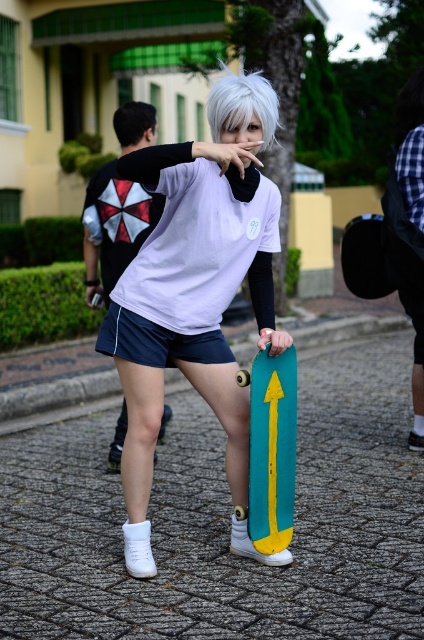
You are trying to determine if the teal matte skateboard at center can fit into a storage compartment that is the same size as the matte white shorts at center. Based on their sizes, will the skateboard fit?

The teal matte skateboard at center occupies less space than the matte white shorts at center, so it will fit into the storage compartment.

You are a photographer planning to capture a closeup shot of the cobblestone pavement at center and the white matte wig at center. Which object should you focus on first if you want to ensure both are in focus without adjusting the camera settings?

The cobblestone pavement at center occupies less space than the white matte wig at center, so you should focus on the white matte wig at center first to ensure both are in focus.

You are a photographer trying to capture the perfect shot of the cobblestone pavement at center and the matte white shorts at center. If you want to ensure both are in focus, how far apart are they from each other?

The cobblestone pavement at center and matte white shorts at center are 9.88 feet apart.